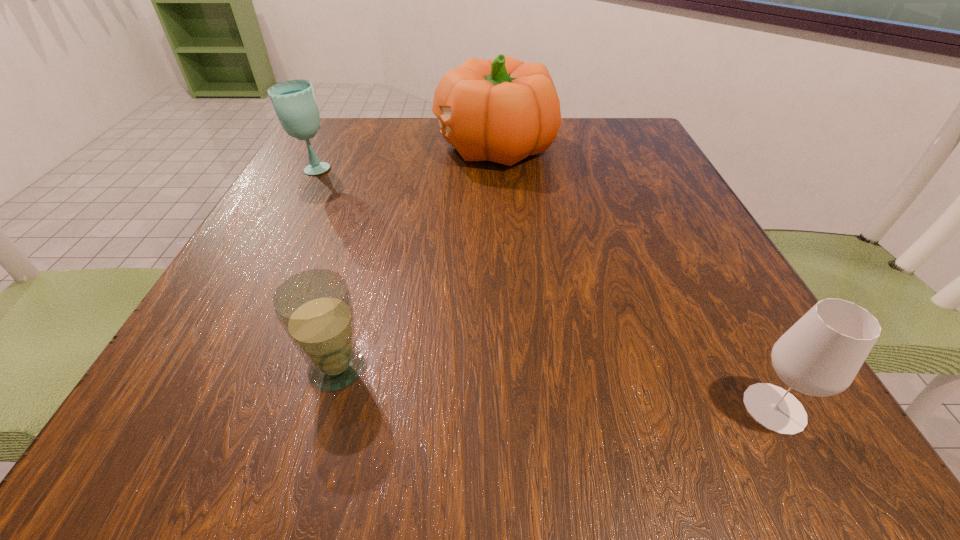
This screenshot has width=960, height=540. I want to click on the tallest object, so click(x=503, y=110).

The image size is (960, 540). I want to click on pumpkin, so click(x=503, y=110).

At what (x,y) coordinates should I click in order to perform the action: click on the farthest glass. Please return your answer as a coordinate pair (x, y). Looking at the image, I should click on (294, 101).

Where is `the leftmost glass`? Image resolution: width=960 pixels, height=540 pixels. the leftmost glass is located at coordinates (294, 101).

Locate an element on the screen. the rightmost object is located at coordinates (820, 355).

Identify the location of the second object from left to right. (314, 307).

Image resolution: width=960 pixels, height=540 pixels. I want to click on the shortest object, so click(x=314, y=307).

Where is `vacant space located 0.270m on the carved face of the second object from right to left`? The image size is (960, 540). vacant space located 0.270m on the carved face of the second object from right to left is located at coordinates click(319, 146).

Locate an element on the screen. free spot located on the carved face of the second object from right to left is located at coordinates (305, 146).

Identify the location of free space located on the carved face of the second object from right to left. (413, 146).